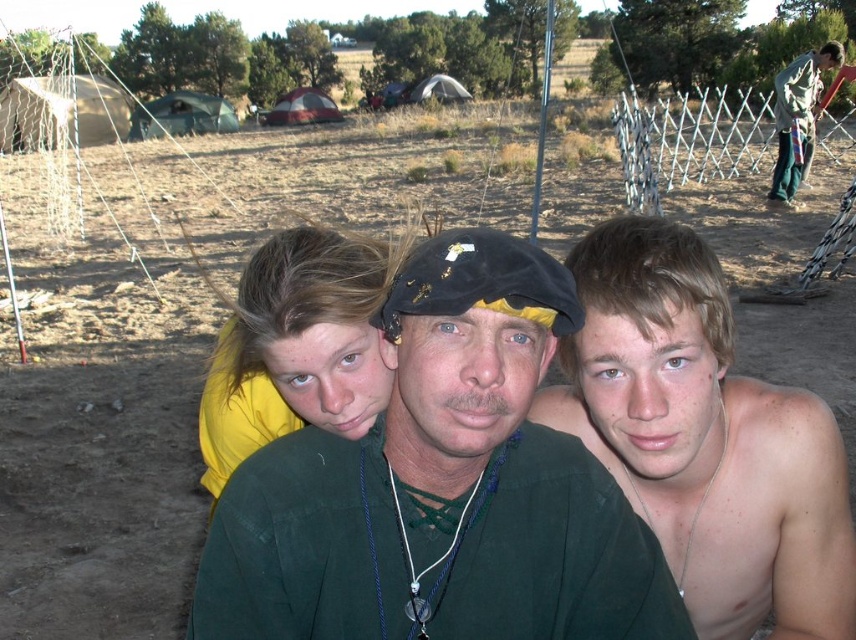
Which is above, green fabric shirt at center or green fabric pants at right?

green fabric pants at right is higher up.

Can you confirm if green fabric shirt at center is shorter than green fabric pants at right?

Correct, green fabric shirt at center is not as tall as green fabric pants at right.

Locate an element on the screen. The width and height of the screenshot is (856, 640). green fabric shirt at center is located at coordinates (441, 486).

The height and width of the screenshot is (640, 856). I want to click on green fabric shirt at center, so click(x=441, y=486).

At what (x,y) coordinates should I click in order to perform the action: click on green fabric shirt at center. Please return your answer as a coordinate pair (x, y). The height and width of the screenshot is (640, 856). Looking at the image, I should click on (441, 486).

Is point (363, 248) more distant than point (782, 195)?

No, it is not.

Is yellow fabric at center below green fabric pants at right?

Indeed, yellow fabric at center is positioned under green fabric pants at right.

Between point (210, 417) and point (816, 93), which one is positioned behind?

Positioned behind is point (816, 93).

Identify the location of yellow fabric at center. (296, 346).